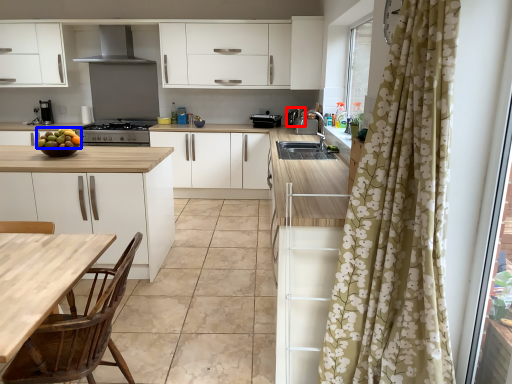
Question: Which point is further to the camera, appliance (highlighted by a red box) or fruit (highlighted by a blue box)?

Choices:
 (A) appliance
 (B) fruit

Answer: (A)